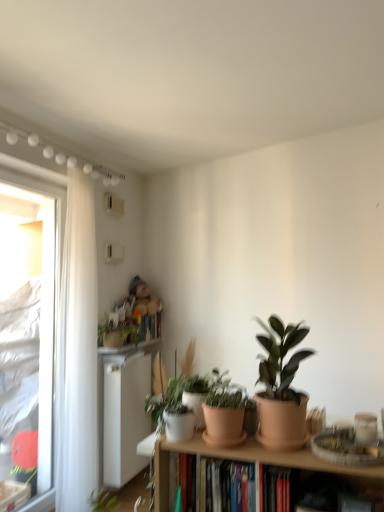
Question: Is matte terracotta pot at right, acting as the 3th houseplant starting from the back, positioned with its back to green matte plant at upper left, placed as the third houseplant when sorted from front to back?

Choices:
 (A) yes
 (B) no

Answer: (B)

Question: Is matte terracotta pot at right, which is counted as the third houseplant, starting from the left, not inside green matte plant at upper left, which is the 1th houseplant in back-to-front order?

Choices:
 (A) yes
 (B) no

Answer: (A)

Question: Is matte terracotta pot at right, acting as the 3th houseplant starting from the back, directly adjacent to green matte plant at upper left, placed as the third houseplant when sorted from front to back?

Choices:
 (A) yes
 (B) no

Answer: (B)

Question: From the image's perspective, is matte terracotta pot at right, which is counted as the third houseplant, starting from the left, under green matte plant at upper left, marked as the third houseplant in a right-to-left arrangement?

Choices:
 (A) yes
 (B) no

Answer: (B)

Question: Does matte terracotta pot at right, which is counted as the third houseplant, starting from the left, have a smaller size compared to green matte plant at upper left, the first houseplant viewed from the left?

Choices:
 (A) no
 (B) yes

Answer: (B)

Question: Is green matte plant at upper left, which is the 1th houseplant in back-to-front order, located within matte terracotta pot at right, which is counted as the third houseplant, starting from the left?

Choices:
 (A) no
 (B) yes

Answer: (A)

Question: Can you confirm if green matte plant at upper left, which is the 1th houseplant in back-to-front order, is bigger than hardcover books at center?

Choices:
 (A) no
 (B) yes

Answer: (B)

Question: Can you confirm if green matte plant at upper left, placed as the third houseplant when sorted from front to back, is taller than hardcover books at center?

Choices:
 (A) yes
 (B) no

Answer: (A)

Question: Is hardcover books at center at the back of green matte plant at upper left, which is the 1th houseplant in back-to-front order?

Choices:
 (A) yes
 (B) no

Answer: (B)

Question: Does green matte plant at upper left, which is the 1th houseplant in back-to-front order, have a lesser height compared to hardcover books at center?

Choices:
 (A) yes
 (B) no

Answer: (B)

Question: From a real-world perspective, is green matte plant at upper left, which is the 1th houseplant in back-to-front order, on top of hardcover books at center?

Choices:
 (A) yes
 (B) no

Answer: (A)

Question: From the image's perspective, does green matte plant at upper left, placed as the third houseplant when sorted from front to back, appear higher than hardcover books at center?

Choices:
 (A) yes
 (B) no

Answer: (A)

Question: From the image's perspective, is white plastic radiator at lower left above green matte plant at center, acting as the 2th houseplant starting from the front?

Choices:
 (A) yes
 (B) no

Answer: (B)